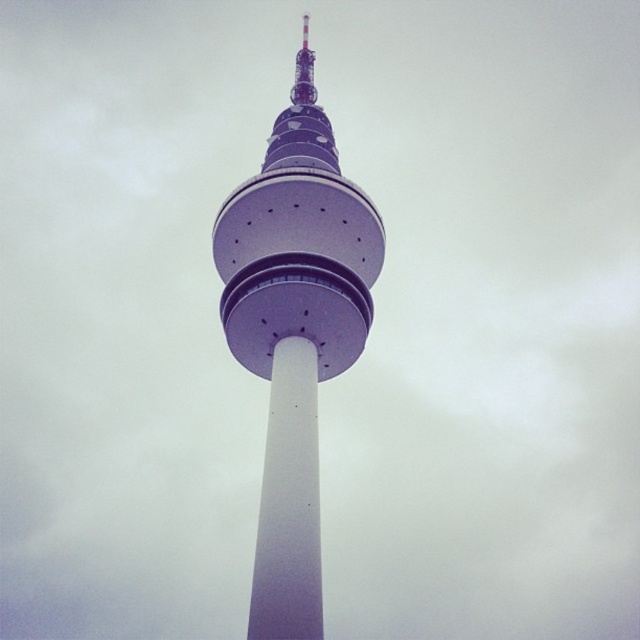
Find the location of a particular element. The height and width of the screenshot is (640, 640). purple metallic tower at center is located at coordinates (296, 333).

Can you confirm if purple metallic tower at center is positioned to the right of white smooth pole at center?

Incorrect, purple metallic tower at center is not on the right side of white smooth pole at center.

This screenshot has width=640, height=640. Identify the location of purple metallic tower at center. (296, 333).

The image size is (640, 640). Find the location of `purple metallic tower at center`. purple metallic tower at center is located at coordinates (296, 333).